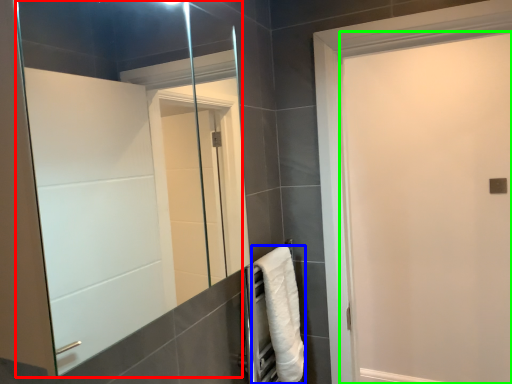
Question: Based on their relative distances, which object is nearer to mirror (highlighted by a red box)? Choose from towel (highlighted by a blue box) and screen door (highlighted by a green box).

Choices:
 (A) towel
 (B) screen door

Answer: (A)